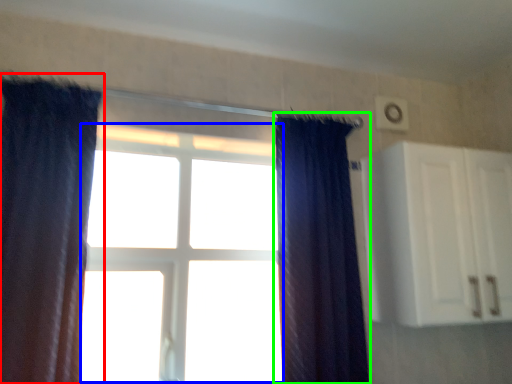
Question: Which object is the closest to the curtain (highlighted by a red box)? Choose among these: bay window (highlighted by a blue box) or curtain (highlighted by a green box).

Choices:
 (A) bay window
 (B) curtain

Answer: (A)